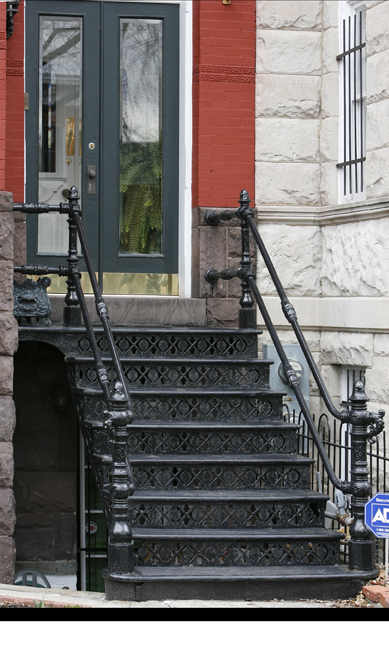
Identify the location of inner door. (68, 171).